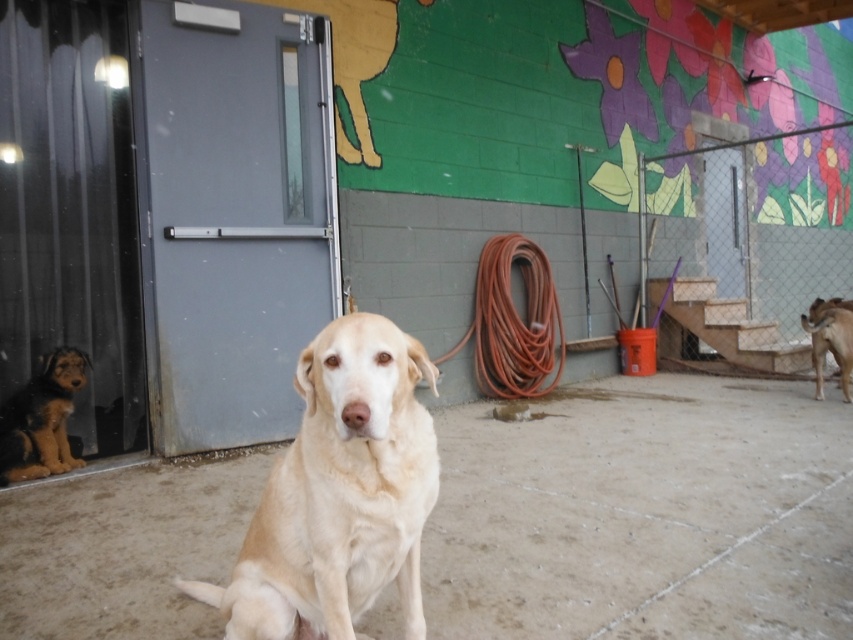
You are a photographer trying to capture the light beige fur at center and the rubber hose at center in the same frame. Based on their positions, which object will appear closer to the camera in the photo?

The light beige fur at center will appear closer to the camera because it is in front of the rubber hose at center.

You are a photographer trying to capture both the brown fur puppy at left and the golden fur dog at right in the same frame. Based on their positions, which dog should you focus on first to ensure both are in focus?

You should focus on the golden fur dog at right first because the brown fur puppy at left is in front of it, so adjusting focus starting from the farther subject might help both be in focus.

You are a photographer setting up a shot of the light beige fur at center and the rubber hose at center. To avoid the hose from blocking the dog, where should you position the hose?

The light beige fur at center is positioned under the rubber hose at center, so to avoid the hose blocking the dog, you should move the rubber hose at center to a different location away from the light beige fur at center.